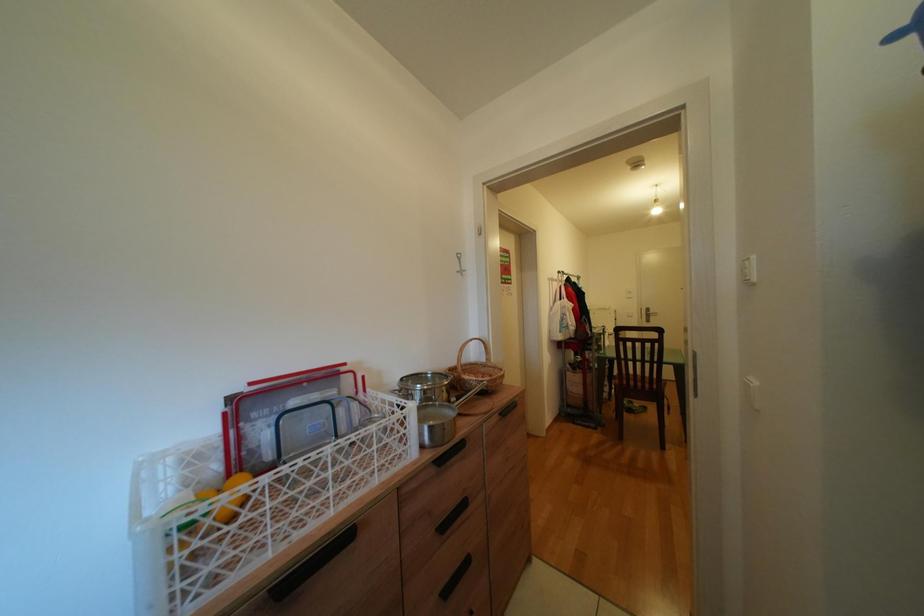
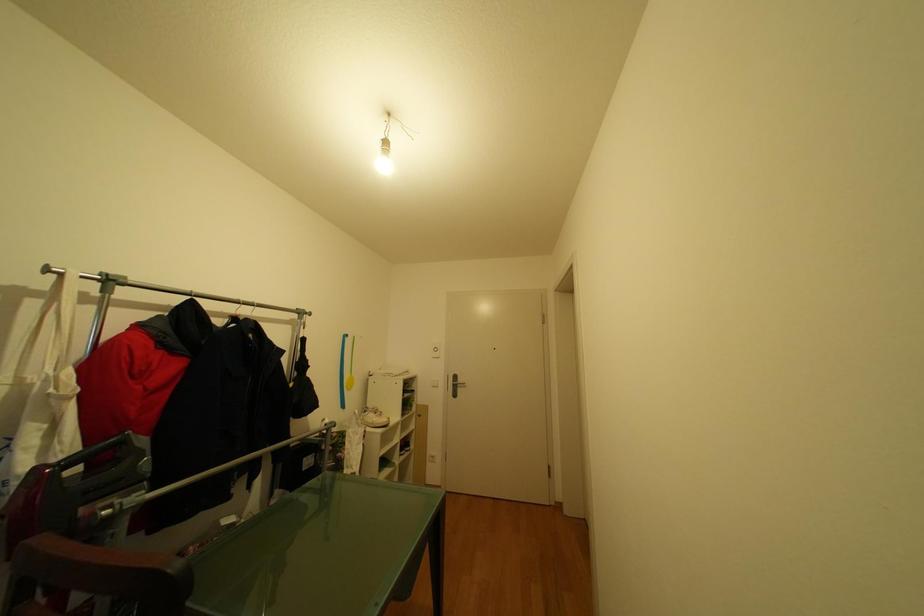
From the picture: The images are taken continuously from a first-person perspective. In which direction are you moving?

The movement direction of the cameraman is right, forward.